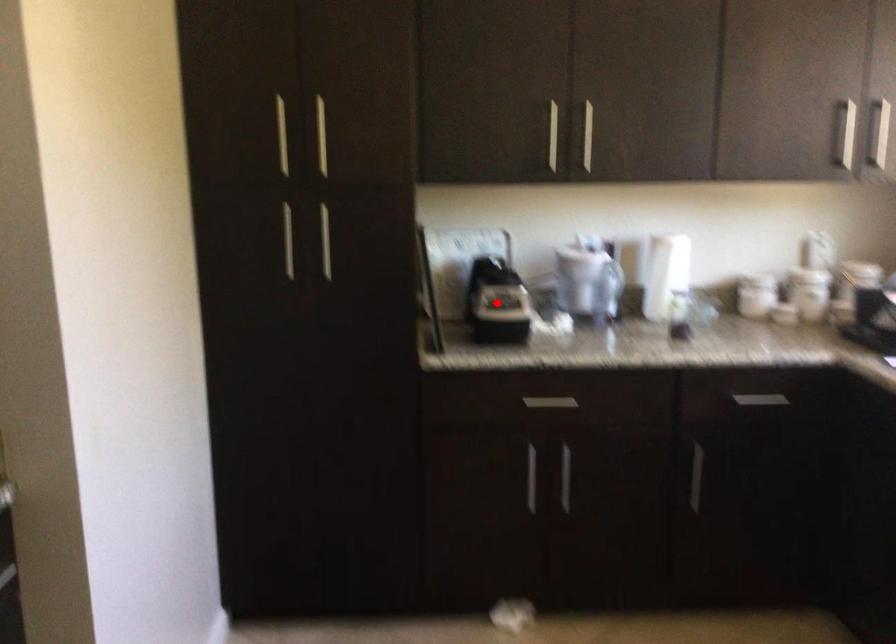
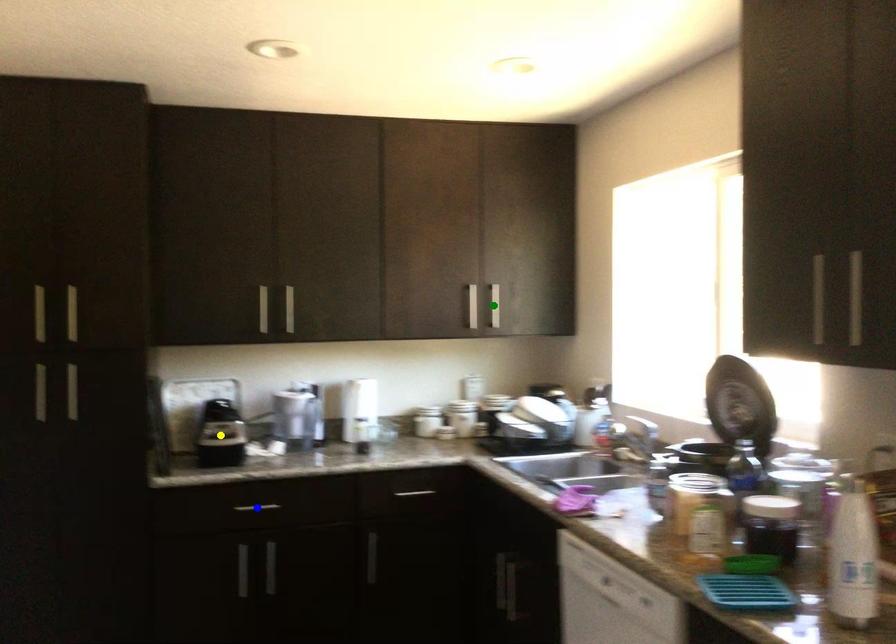
Question: I am providing you with two images of the same scene from different viewpoints. A red point is marked on the first image. You are given multiple points on the second image. Which mark in image 2 goes with the point in image 1?

Choices:
 (A) blue point
 (B) yellow point
 (C) green point

Answer: (B)